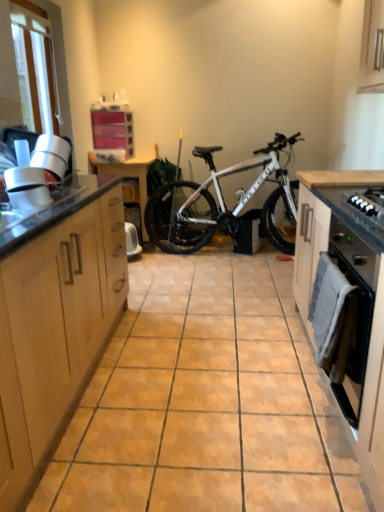
The width and height of the screenshot is (384, 512). Find the location of `vacant area situated to the left side of black matte oven door at right, marked as the 1th cabinetry in a right-to-left arrangement`. vacant area situated to the left side of black matte oven door at right, marked as the 1th cabinetry in a right-to-left arrangement is located at coordinates (264, 428).